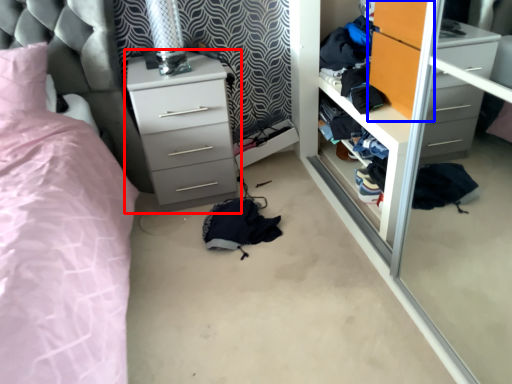
Question: Which object is closer to the camera taking this photo, chest of drawers (highlighted by a red box) or armoire (highlighted by a blue box)?

Choices:
 (A) chest of drawers
 (B) armoire

Answer: (B)